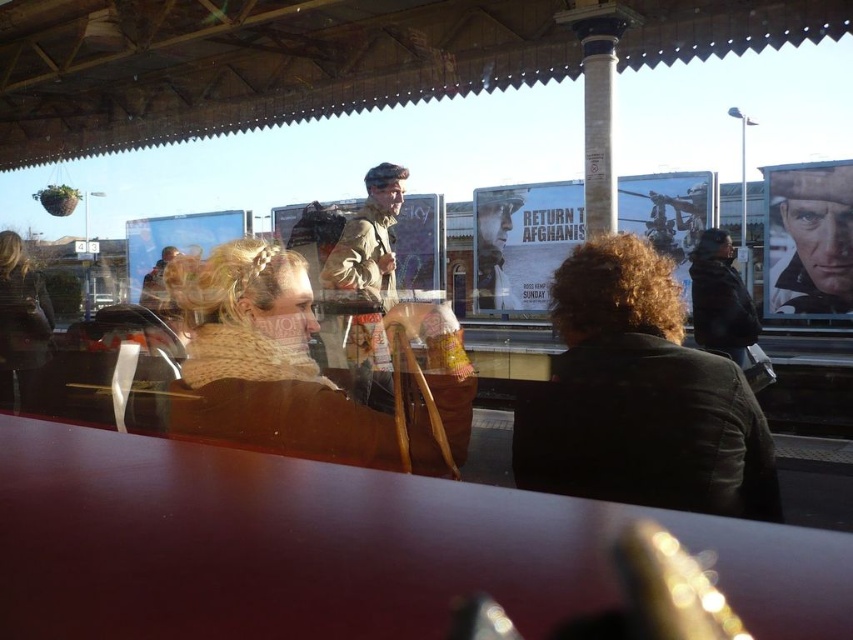
Consider the image. Is smooth leather jacket at upper right below camouflage fabric jacket at center?

No, smooth leather jacket at upper right is not below camouflage fabric jacket at center.

Does point (769, 244) come closer to viewer compared to point (381, 410)?

No, it is not.

Locate an element on the screen. smooth leather jacket at upper right is located at coordinates (808, 240).

Which of these two, knitted beige scarf at center or dark brown fur coat at right, stands taller?

dark brown fur coat at right is taller.

Which is more to the left, knitted beige scarf at center or dark brown fur coat at right?

Positioned to the left is knitted beige scarf at center.

Image resolution: width=853 pixels, height=640 pixels. What are the coordinates of `knitted beige scarf at center` in the screenshot? It's located at (288, 371).

Which is in front, point (581, 438) or point (357, 269)?

Point (581, 438)

Which of these two, dark brown leather jacket at center or camouflage fabric jacket at center, stands taller?

camouflage fabric jacket at center is taller.

Locate an element on the screen. This screenshot has width=853, height=640. dark brown leather jacket at center is located at coordinates (639, 397).